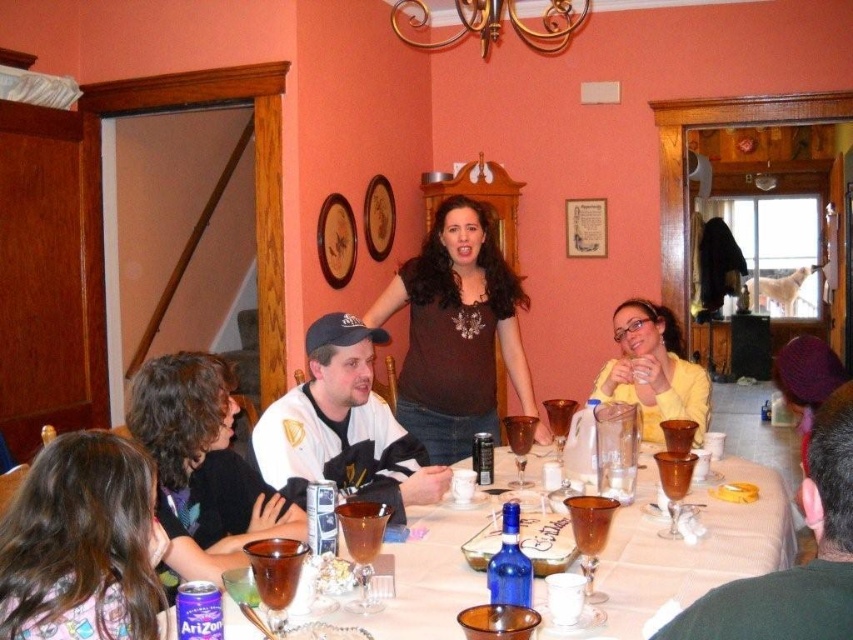
Question: Which point is farther to the camera?

Choices:
 (A) brown glassware at lower center
 (B) gold metallic chandelier at upper center

Answer: (B)

Question: Is brown hair at center thinner than yellow matte sweater at center?

Choices:
 (A) no
 (B) yes

Answer: (B)

Question: Among these objects, which one is nearest to the camera?

Choices:
 (A) blue glass bottle at center
 (B) brown hair at center

Answer: (B)

Question: Does brown hair at center appear over gold metallic chandelier at upper center?

Choices:
 (A) no
 (B) yes

Answer: (A)

Question: Among these points, which one is farthest from the camera?

Choices:
 (A) (107, 586)
 (B) (489, 548)

Answer: (B)

Question: Can you confirm if brown glassware at lower center is positioned below blue glass bottle at center?

Choices:
 (A) yes
 (B) no

Answer: (A)